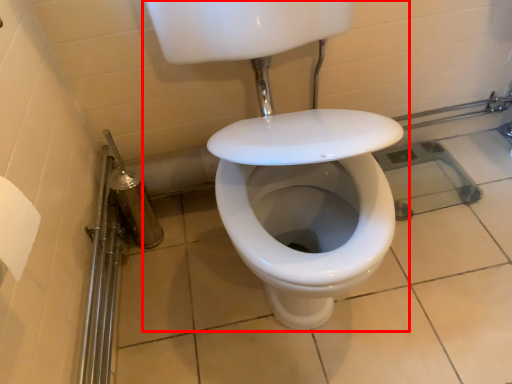
Question: From the image's perspective, where is sink (annotated by the red box) located relative to shower?

Choices:
 (A) above
 (B) below

Answer: (A)